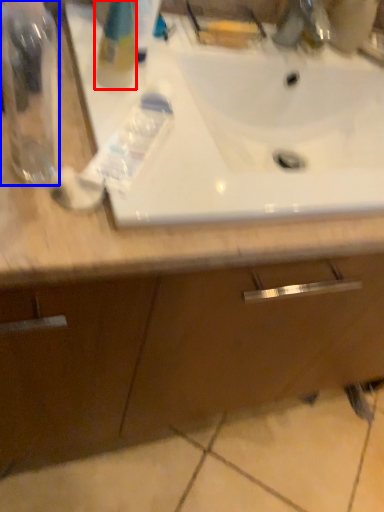
Question: Among these objects, which one is farthest to the camera, cleaning product (highlighted by a red box) or bottle (highlighted by a blue box)?

Choices:
 (A) cleaning product
 (B) bottle

Answer: (A)